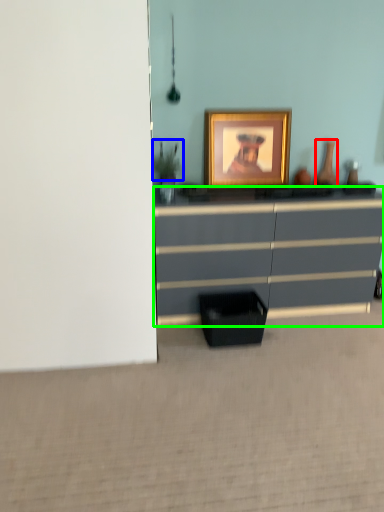
Question: Which object is positioned farthest from vase (highlighted by a red box)? Select from plant (highlighted by a blue box) and chest of drawers (highlighted by a green box).

Choices:
 (A) plant
 (B) chest of drawers

Answer: (A)